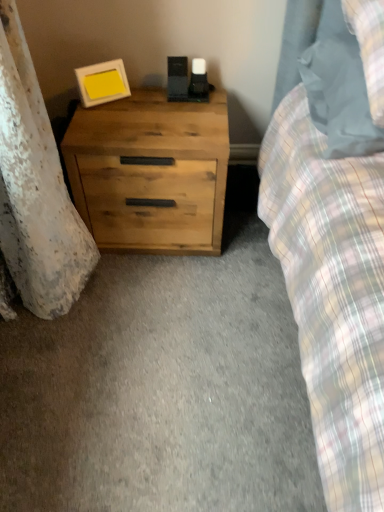
Question: Is natural wood chest of drawers at lower left taller than matte gray pillow at upper right?

Choices:
 (A) yes
 (B) no

Answer: (A)

Question: Is natural wood chest of drawers at lower left aimed at matte gray pillow at upper right?

Choices:
 (A) no
 (B) yes

Answer: (A)

Question: Does natural wood chest of drawers at lower left come behind matte gray pillow at upper right?

Choices:
 (A) no
 (B) yes

Answer: (B)

Question: From a real-world perspective, does natural wood chest of drawers at lower left stand above matte gray pillow at upper right?

Choices:
 (A) no
 (B) yes

Answer: (A)

Question: From the image's perspective, is natural wood chest of drawers at lower left over matte gray pillow at upper right?

Choices:
 (A) no
 (B) yes

Answer: (A)

Question: Does natural wood chest of drawers at lower left have a lesser width compared to matte gray pillow at upper right?

Choices:
 (A) no
 (B) yes

Answer: (B)

Question: Considering the relative positions of matte gray pillow at upper right and matte white picture frame at upper left in the image provided, is matte gray pillow at upper right to the left of matte white picture frame at upper left from the viewer's perspective?

Choices:
 (A) no
 (B) yes

Answer: (A)

Question: From a real-world perspective, does matte gray pillow at upper right stand above matte white picture frame at upper left?

Choices:
 (A) no
 (B) yes

Answer: (B)

Question: From the image's perspective, does matte gray pillow at upper right appear lower than matte white picture frame at upper left?

Choices:
 (A) no
 (B) yes

Answer: (B)

Question: Is matte gray pillow at upper right thinner than matte white picture frame at upper left?

Choices:
 (A) no
 (B) yes

Answer: (A)

Question: Considering the relative sizes of matte gray pillow at upper right and matte white picture frame at upper left in the image provided, is matte gray pillow at upper right wider than matte white picture frame at upper left?

Choices:
 (A) no
 (B) yes

Answer: (B)

Question: Is matte gray pillow at upper right far away from matte white picture frame at upper left?

Choices:
 (A) no
 (B) yes

Answer: (A)

Question: Could you tell me if matte gray pillow at upper right is facing natural wood chest of drawers at lower left?

Choices:
 (A) yes
 (B) no

Answer: (B)